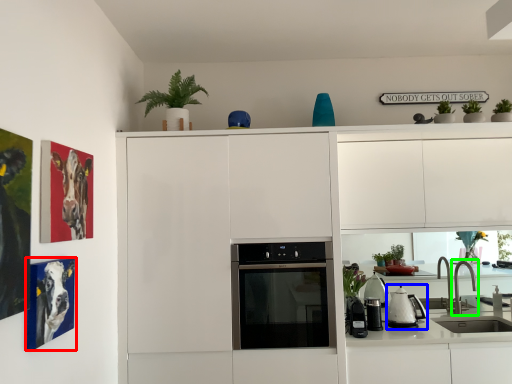
Question: Based on their relative distances, which object is nearer to picture frame (highlighted by a red box)? Choose from kitchen appliance (highlighted by a blue box) and tap (highlighted by a green box).

Choices:
 (A) kitchen appliance
 (B) tap

Answer: (A)